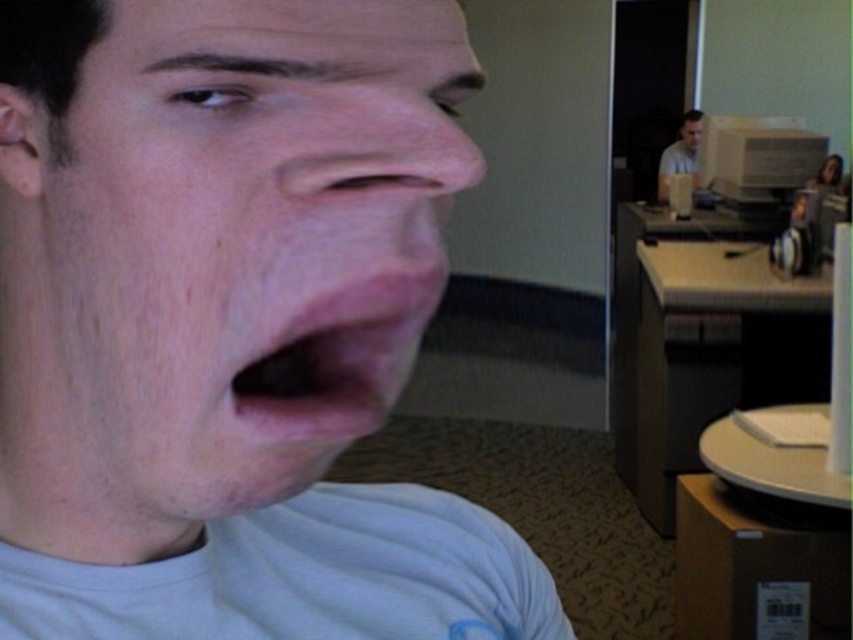
Question: Which object appears closest to the camera in this image?

Choices:
 (A) smooth skin face at center
 (B) matte white face at upper center
 (C) light blue shirt at upper right
 (D) matte gray monitor at upper right

Answer: (A)

Question: Which of the following is the farthest from the observer?

Choices:
 (A) matte gray monitor at upper right
 (B) matte white face at upper center

Answer: (B)

Question: Is smooth skin face at center thinner than pink flesh-colored lips at center?

Choices:
 (A) no
 (B) yes

Answer: (A)

Question: Which point is farther to the camera?

Choices:
 (A) light blue shirt at upper right
 (B) matte white face at upper center
 (C) smooth skin face at center

Answer: (B)

Question: Does light blue shirt at upper right lie behind matte white face at upper center?

Choices:
 (A) yes
 (B) no

Answer: (B)

Question: Observing the image, what is the correct spatial positioning of matte gray monitor at upper right in reference to matte white face at upper center?

Choices:
 (A) right
 (B) left

Answer: (B)